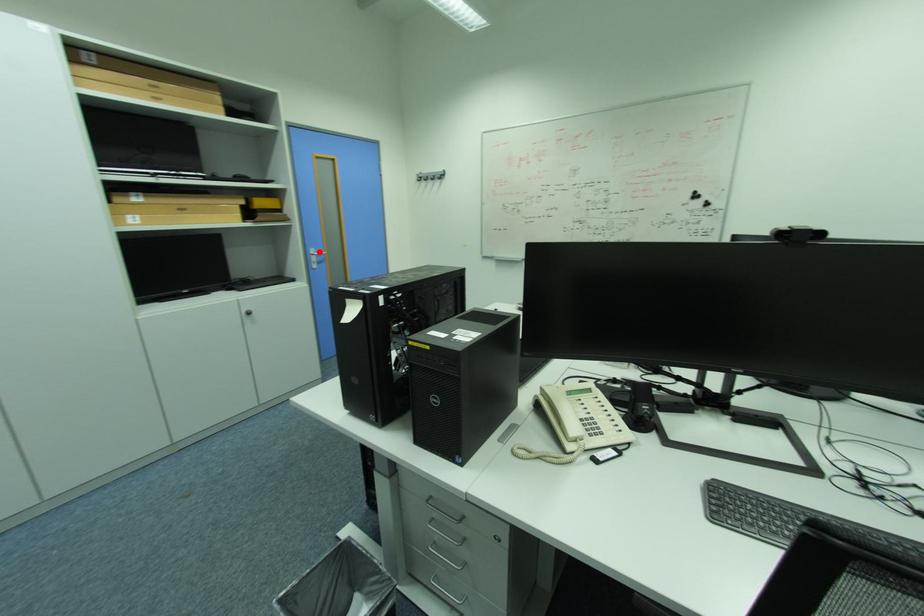
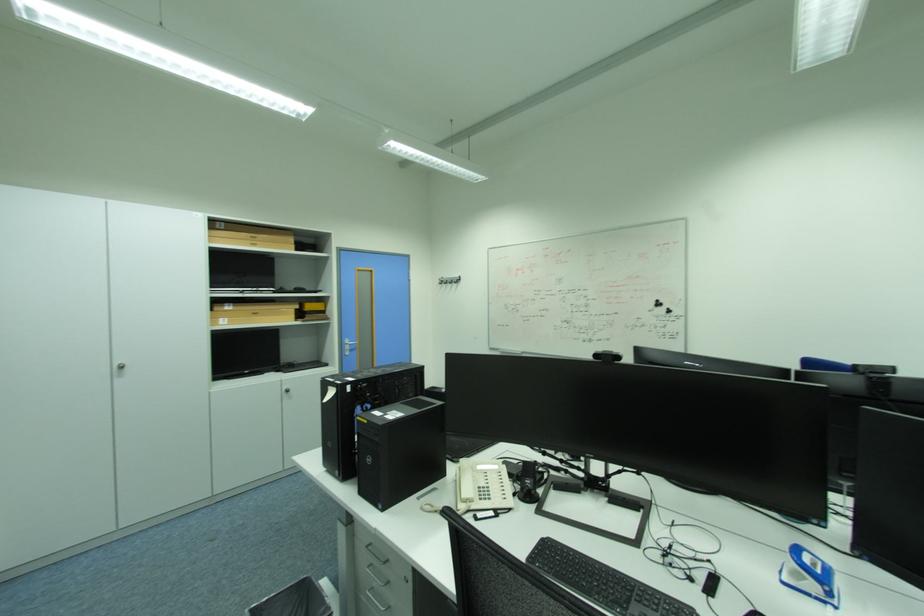
In the second image, find the point that corresponds to the highlighted location in the first image.

(355, 342)